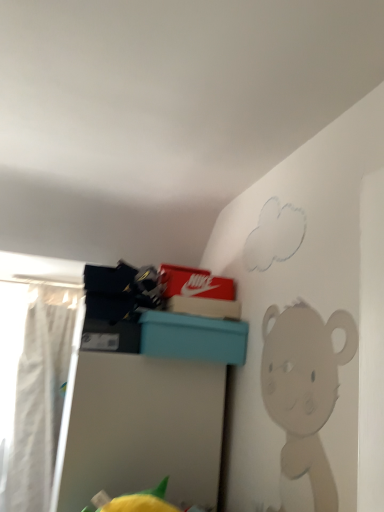
Question: Is white fabric curtain at left spatially inside teal plastic storage bin at upper center, or outside of it?

Choices:
 (A) inside
 (B) outside

Answer: (B)

Question: Considering the positions of point (13, 437) and point (178, 344), is point (13, 437) closer or farther from the camera than point (178, 344)?

Choices:
 (A) closer
 (B) farther

Answer: (B)

Question: Is white fabric curtain at left in front of or behind teal plastic storage bin at upper center in the image?

Choices:
 (A) front
 (B) behind

Answer: (B)

Question: Based on their positions, is teal plastic storage bin at upper center located to the left or right of white fabric curtain at left?

Choices:
 (A) left
 (B) right

Answer: (B)

Question: Which is correct: teal plastic storage bin at upper center is inside white fabric curtain at left, or outside of it?

Choices:
 (A) outside
 (B) inside

Answer: (A)

Question: Is teal plastic storage bin at upper center wider or thinner than white fabric curtain at left?

Choices:
 (A) wide
 (B) thin

Answer: (A)

Question: From their relative heights in the image, would you say teal plastic storage bin at upper center is taller or shorter than white fabric curtain at left?

Choices:
 (A) short
 (B) tall

Answer: (A)